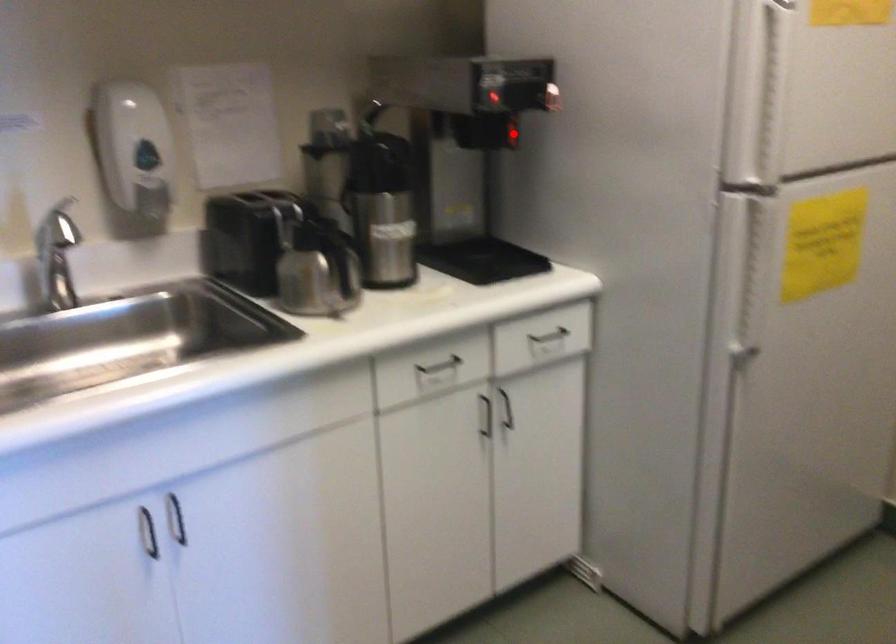
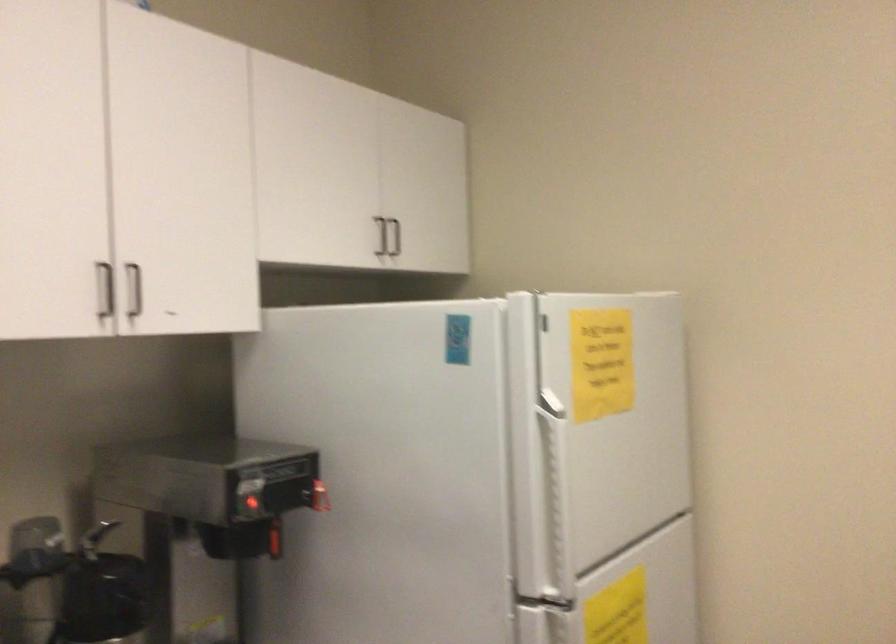
The point at the highlighted location is marked in the first image. Where is the corresponding point in the second image?

(273, 541)